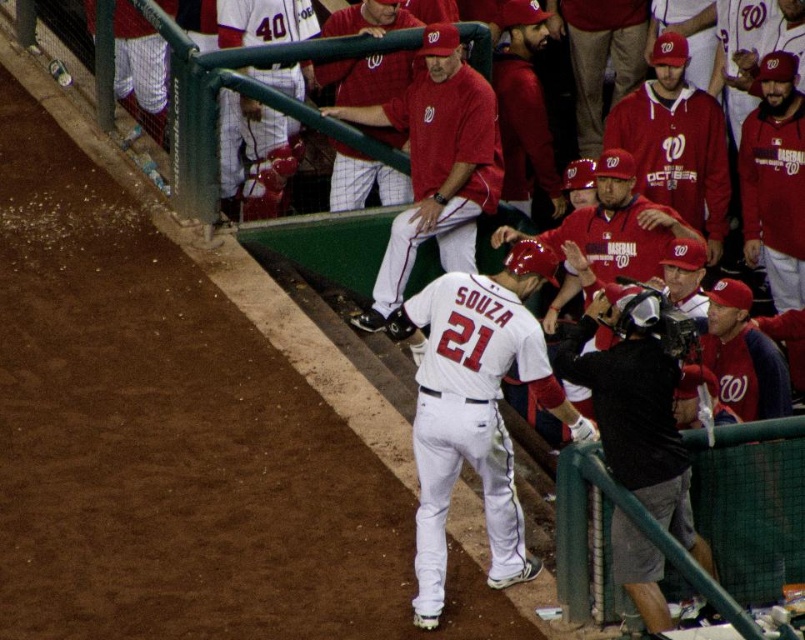
You are a photographer standing at the edge of the baseball field. You have a black fabric camera at center in your hand. You want to take a photo of the Washington Nationals player Souza walking towards the dugout. Can you focus on him clearly with this camera?

The black fabric camera at center is 6.76 meters from camera, so yes, the photographer can focus on Souza clearly as the distance is within the camera lens range.

In the night baseball game scene, you notice a white jersey at upper center and a matte red baseball cap at center. Which object appears taller in the image?

The white jersey at upper center is taller than the matte red baseball cap at center.

You are a photographer positioned at the origin point in the dugout. You want to capture a photo of both the point at (292, 132) and the point at (345, 172). Can you include both points in your shot without moving your camera?

Point (292, 132) is behind point (345, 172), so if you are positioned at the origin, you might not be able to see both points clearly in the same frame without moving the camera because one is obstructed by the other.